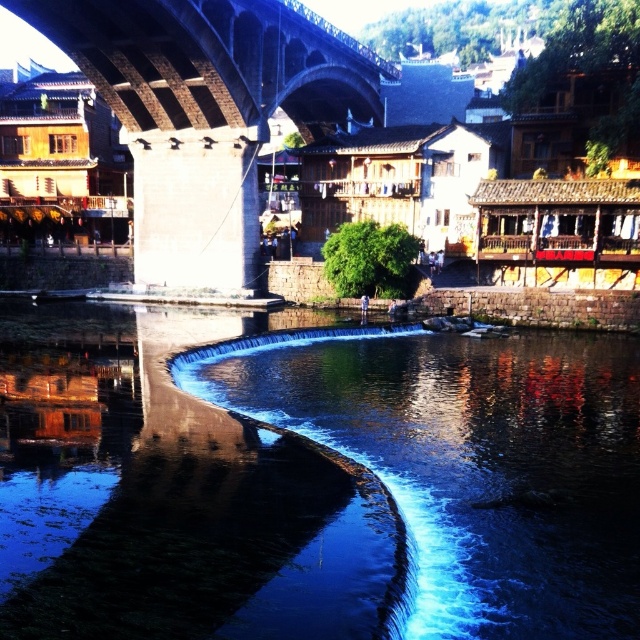
Question: Among these objects, which one is farthest from the camera?

Choices:
 (A) stone textured arch bridge at center
 (B) blue smooth water at center

Answer: (A)

Question: Does blue smooth water at center have a greater width compared to stone textured arch bridge at center?

Choices:
 (A) yes
 (B) no

Answer: (A)

Question: Is blue smooth water at center thinner than stone textured arch bridge at center?

Choices:
 (A) yes
 (B) no

Answer: (B)

Question: Can you confirm if blue smooth water at center is positioned to the right of stone textured arch bridge at center?

Choices:
 (A) yes
 (B) no

Answer: (A)